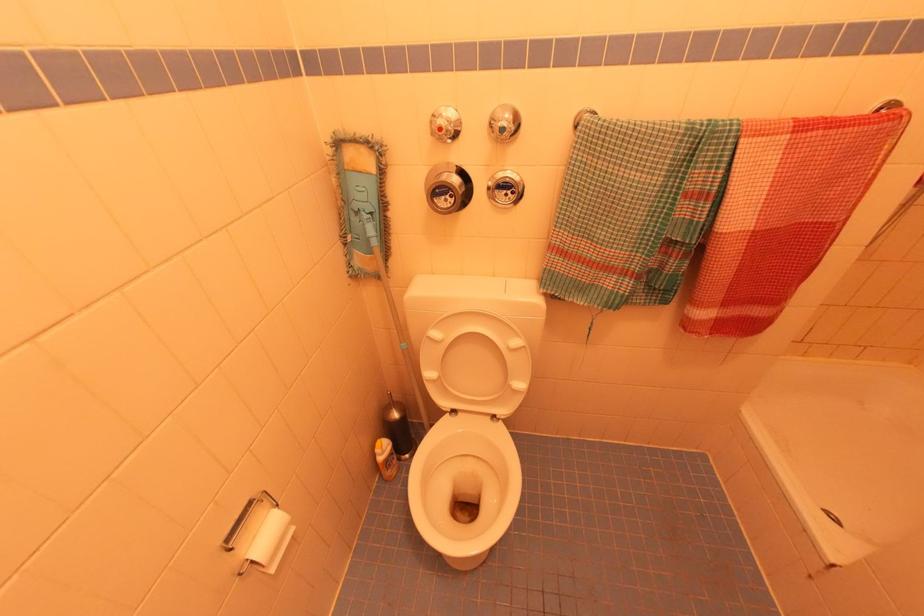
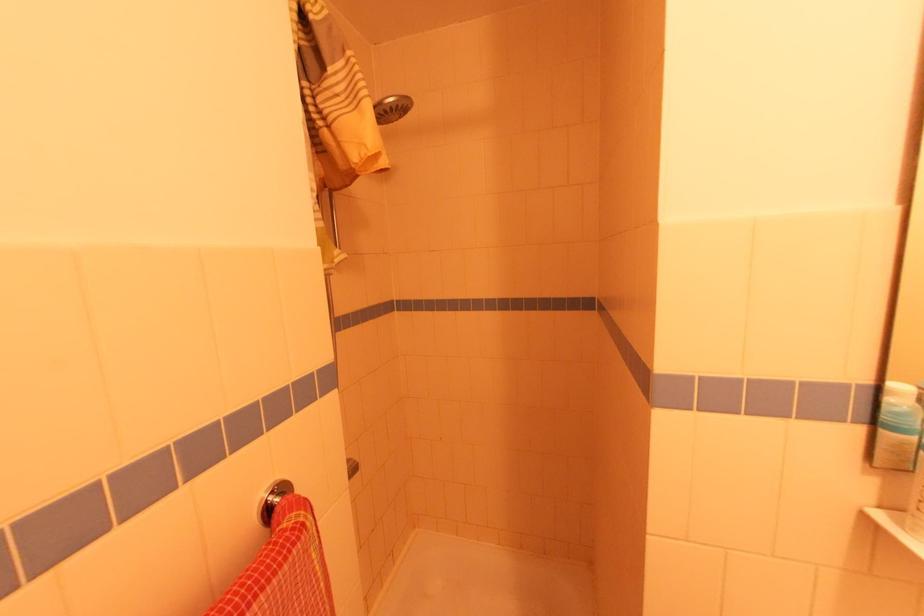
Question: Based on the continuous images, in which direction is the camera rotating? Reply with the corresponding letter.

Choices:
 (A) Left
 (B) Right
 (C) Up
 (D) Down

Answer: (B)